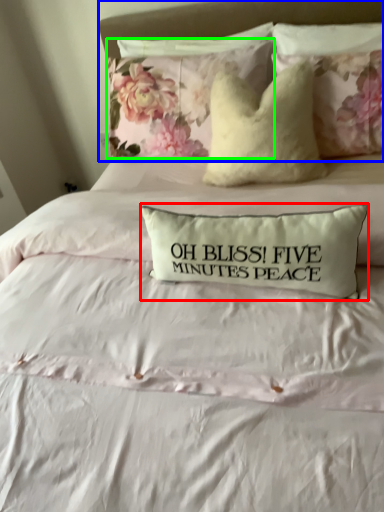
Question: Which object is positioned farthest from pillow (highlighted by a red box)? Select from headboard (highlighted by a blue box) and pillow (highlighted by a green box).

Choices:
 (A) headboard
 (B) pillow

Answer: (A)